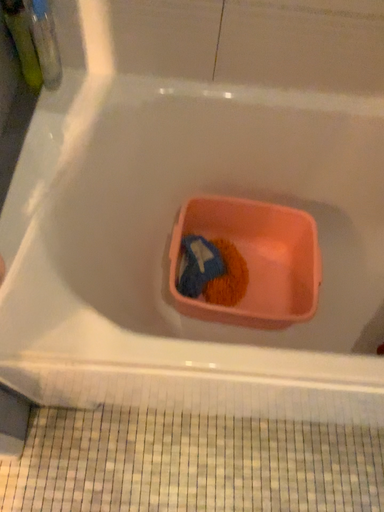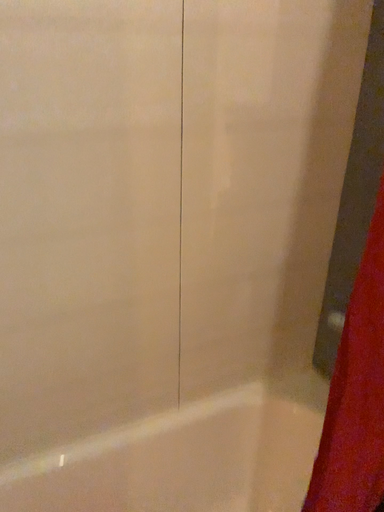
Question: How did the camera likely rotate when shooting the video?

Choices:
 (A) rotated right
 (B) rotated left

Answer: (A)